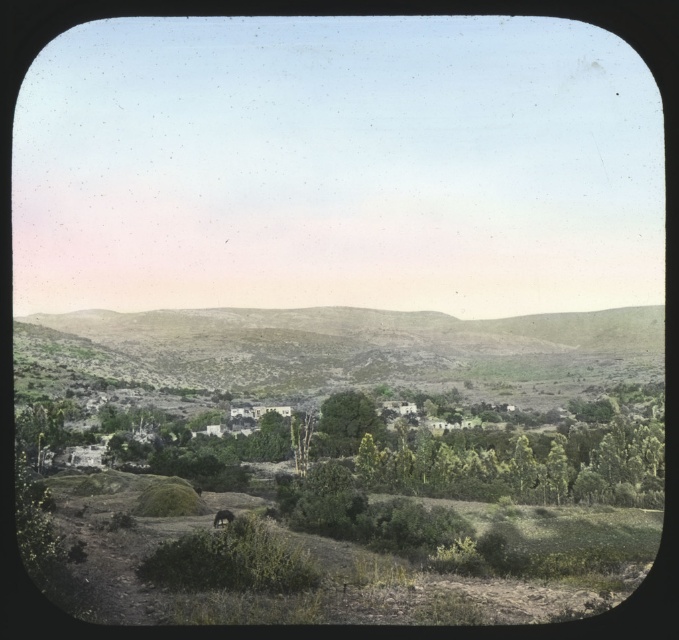
Is point (329, 416) positioned after point (213, 516)?

Yes, it is behind point (213, 516).

From the picture: Who is higher up, green leafy tree at center or brown furry dog at lower center?

green leafy tree at center

Which is behind, point (318, 428) or point (221, 509)?

Positioned behind is point (318, 428).

Find the location of a particular element. The width and height of the screenshot is (679, 640). green leafy tree at center is located at coordinates (346, 424).

Does point (661, 355) come closer to viewer compared to point (367, 408)?

Yes, it is in front of point (367, 408).

Can you confirm if green grassy hillside at center is positioned below green leafy tree at center?

Incorrect, green grassy hillside at center is not positioned below green leafy tree at center.

Does point (299, 365) come in front of point (340, 396)?

That is False.

Locate an element on the screen. green grassy hillside at center is located at coordinates (356, 348).

Which is more to the right, green grassy hillside at center or brown furry dog at lower center?

green grassy hillside at center

Does point (185, 346) come in front of point (232, 513)?

No, it is not.

Between point (120, 326) and point (217, 525), which one is positioned in front?

Positioned in front is point (217, 525).

At what (x,y) coordinates should I click in order to perform the action: click on green grassy hillside at center. Please return your answer as a coordinate pair (x, y). Looking at the image, I should click on (356, 348).